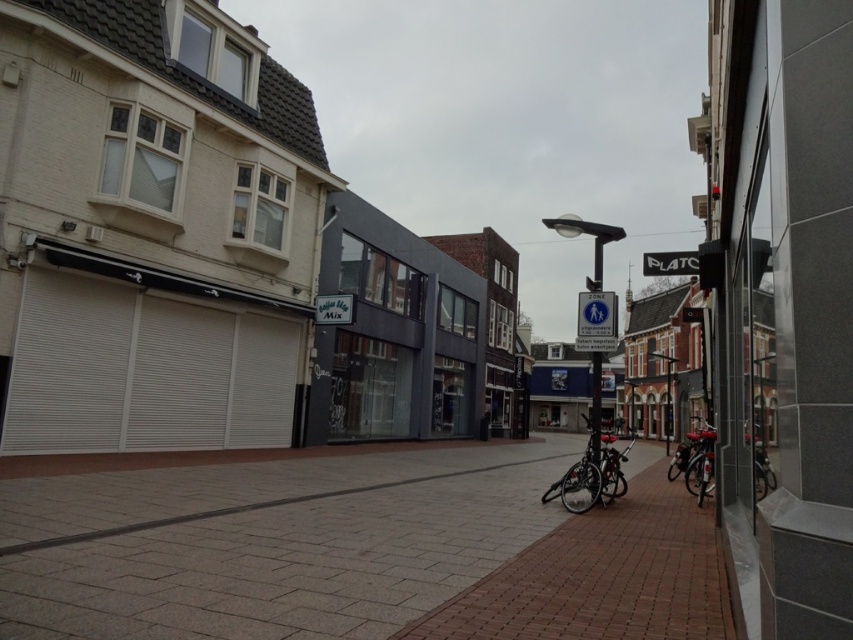
Is brick pavement at center to the left of white plastic sign at center from the viewer's perspective?

Correct, you'll find brick pavement at center to the left of white plastic sign at center.

Can you confirm if brick pavement at center is positioned to the right of white plastic sign at center?

In fact, brick pavement at center is to the left of white plastic sign at center.

Between point (500, 618) and point (593, 289), which one is positioned in front?

Positioned in front is point (500, 618).

I want to click on brick pavement at center, so click(x=358, y=550).

Is shiny metallic bicycle at center positioned before white plastic sign at center?

Yes, it is.

Is point (560, 486) farther from viewer compared to point (593, 362)?

That is False.

Is point (575, 506) less distant than point (599, 259)?

Yes.

The width and height of the screenshot is (853, 640). In order to click on shiny metallic bicycle at center in this screenshot , I will do `click(592, 474)`.

This screenshot has width=853, height=640. Describe the element at coordinates (358, 550) in the screenshot. I see `brick pavement at center` at that location.

Who is more forward, (582, 435) or (598, 464)?

Point (598, 464) is more forward.

At what (x,y) coordinates should I click in order to perform the action: click on brick pavement at center. Please return your answer as a coordinate pair (x, y). The width and height of the screenshot is (853, 640). Looking at the image, I should click on click(358, 550).